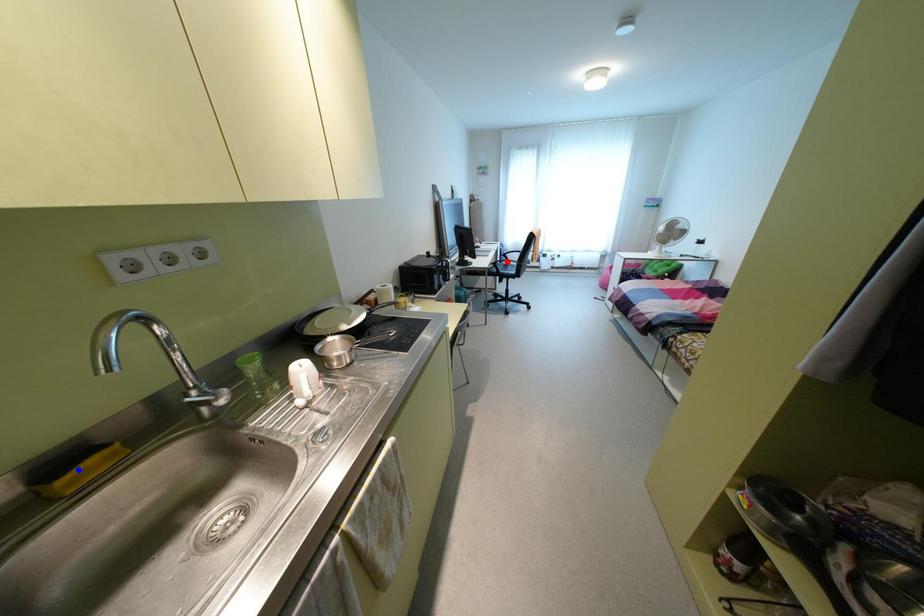
Question: Which of the two points in the image is closer to the camera?

Choices:
 (A) Blue point is closer.
 (B) Red point is closer.

Answer: (A)